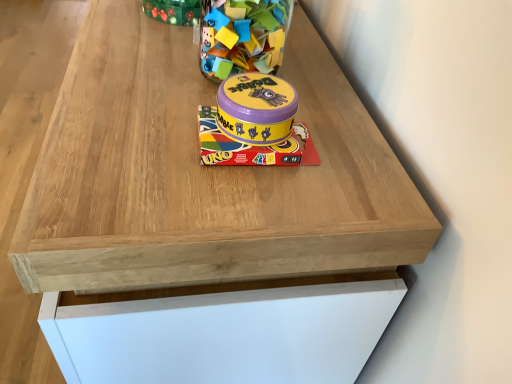
At what (x,y) coordinates should I click in order to perform the action: click on free location to the right of matte purple tin at center, placed as the 1th toy when sorted from bottom to top. Please return your answer as a coordinate pair (x, y). Looking at the image, I should click on (365, 156).